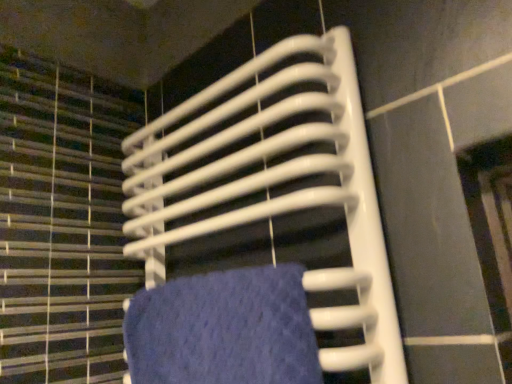
Describe the element at coordinates (276, 185) in the screenshot. I see `white plastic grille at upper center` at that location.

Where is `white plastic grille at upper center`? white plastic grille at upper center is located at coordinates (276, 185).

Where is `white plastic grille at upper center`? The image size is (512, 384). white plastic grille at upper center is located at coordinates (276, 185).